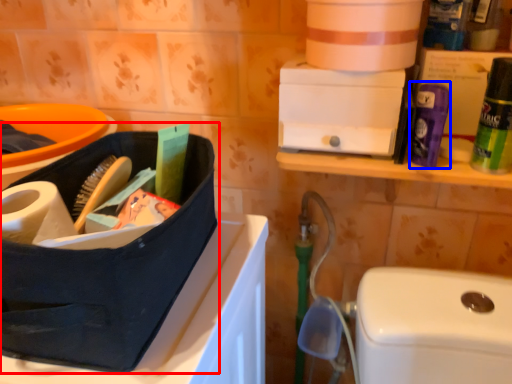
Question: Which point is further to the camera, lunch box (highlighted by a red box) or cleaning product (highlighted by a blue box)?

Choices:
 (A) lunch box
 (B) cleaning product

Answer: (B)